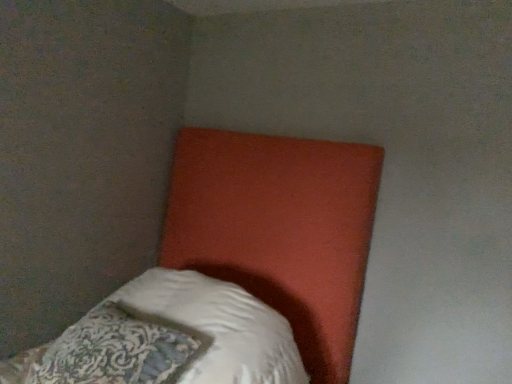
Identify the location of matte orange headboard at upper center. This screenshot has width=512, height=384. (279, 229).

The height and width of the screenshot is (384, 512). Describe the element at coordinates (279, 229) in the screenshot. I see `matte orange headboard at upper center` at that location.

What do you see at coordinates (168, 338) in the screenshot? I see `white soft pillow at lower left` at bounding box center [168, 338].

Locate an element on the screen. white soft pillow at lower left is located at coordinates (168, 338).

Where is `matte orange headboard at upper center`? matte orange headboard at upper center is located at coordinates (279, 229).

Between white soft pillow at lower left and matte orange headboard at upper center, which one appears on the right side from the viewer's perspective?

Positioned to the right is matte orange headboard at upper center.

Is white soft pillow at lower left closer to camera compared to matte orange headboard at upper center?

That is False.

Does point (201, 333) come in front of point (309, 175)?

Yes, it is in front of point (309, 175).

From the image's perspective, which is below, white soft pillow at lower left or matte orange headboard at upper center?

white soft pillow at lower left, from the image's perspective.

From a real-world perspective, is white soft pillow at lower left physically located above or below matte orange headboard at upper center?

In terms of real-world spatial position, white soft pillow at lower left is below matte orange headboard at upper center.

Is white soft pillow at lower left wider or thinner than matte orange headboard at upper center?

In the image, white soft pillow at lower left appears to be more narrow than matte orange headboard at upper center.

Is white soft pillow at lower left taller or shorter than matte orange headboard at upper center?

In the image, white soft pillow at lower left appears to be shorter than matte orange headboard at upper center.

Which of these two, white soft pillow at lower left or matte orange headboard at upper center, is smaller?

white soft pillow at lower left.

Which is correct: white soft pillow at lower left is inside matte orange headboard at upper center, or outside of it?

white soft pillow at lower left can be found inside matte orange headboard at upper center.

Would you say white soft pillow at lower left is a long distance from matte orange headboard at upper center?

No, white soft pillow at lower left is not far from matte orange headboard at upper center.

Is white soft pillow at lower left positioned with its back to matte orange headboard at upper center?

Yes.

How different are the orientations of white soft pillow at lower left and matte orange headboard at upper center in degrees?

2.12 degrees.

Identify the location of bed on the right of white soft pillow at lower left. The image size is (512, 384). (279, 229).

Is matte orange headboard at upper center at the left side of white soft pillow at lower left?

No.

Which object is closer to the camera taking this photo, matte orange headboard at upper center or white soft pillow at lower left?

Positioned in front is matte orange headboard at upper center.

Between point (244, 228) and point (138, 352), which one is positioned behind?

The point (244, 228) is farther from the camera.

From the image's perspective, would you say matte orange headboard at upper center is positioned over white soft pillow at lower left?

Yes.

From a real-world perspective, is matte orange headboard at upper center on white soft pillow at lower left?

Yes, from a real-world perspective, matte orange headboard at upper center is over white soft pillow at lower left

Considering the sizes of objects matte orange headboard at upper center and white soft pillow at lower left in the image provided, who is wider, matte orange headboard at upper center or white soft pillow at lower left?

With larger width is matte orange headboard at upper center.

Does matte orange headboard at upper center have a lesser height compared to white soft pillow at lower left?

Incorrect, the height of matte orange headboard at upper center does not fall short of that of white soft pillow at lower left.

Consider the image. Which of these two, matte orange headboard at upper center or white soft pillow at lower left, is bigger?

matte orange headboard at upper center is bigger.

Is matte orange headboard at upper center inside the boundaries of white soft pillow at lower left, or outside?

matte orange headboard at upper center is located beyond the bounds of white soft pillow at lower left.

Is matte orange headboard at upper center next to white soft pillow at lower left?

No.

Could you tell me if matte orange headboard at upper center is turned towards white soft pillow at lower left?

Yes, matte orange headboard at upper center is aimed at white soft pillow at lower left.

Where is `pillow that appears below the matte orange headboard at upper center (from the image's perspective)`? The width and height of the screenshot is (512, 384). pillow that appears below the matte orange headboard at upper center (from the image's perspective) is located at coordinates (168, 338).

Locate an element on the screen. The width and height of the screenshot is (512, 384). pillow on the left of matte orange headboard at upper center is located at coordinates (168, 338).

You are a GUI agent. You are given a task and a screenshot of the screen. Output one action in this format:
    pyautogui.click(x=<x>, y=<y>)
    Task: Click on the pillow located underneath the matte orange headboard at upper center (from a real-world perspective)
    The width and height of the screenshot is (512, 384).
    Given the screenshot: What is the action you would take?
    pyautogui.click(x=168, y=338)